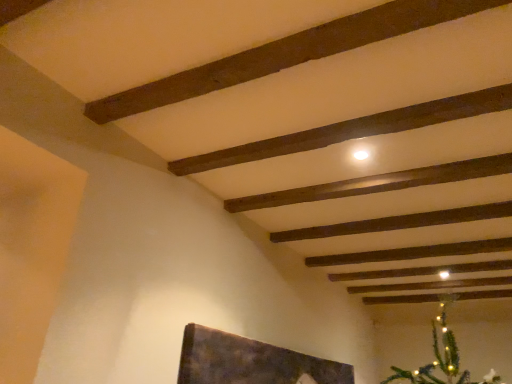
Locate an element on the screen. dark brown wood plank at upper center, which is the 2th plank in top-to-bottom order is located at coordinates (353, 130).

This screenshot has width=512, height=384. Find the location of `dark brown wood plank at upper center, which is the 2th plank in top-to-bottom order`. dark brown wood plank at upper center, which is the 2th plank in top-to-bottom order is located at coordinates (353, 130).

From the picture: Does dark brown wood plank at upper center, placed as the second plank when sorted from bottom to top, appear on the right side of smooth wooden plank at center, arranged as the first plank when ordered from the bottom?

In fact, dark brown wood plank at upper center, placed as the second plank when sorted from bottom to top, is to the left of smooth wooden plank at center, arranged as the first plank when ordered from the bottom.

From a real-world perspective, is dark brown wood plank at upper center, placed as the second plank when sorted from bottom to top, on smooth wooden plank at center, marked as the third plank in a top-to-bottom arrangement?

Indeed, from a real-world perspective, dark brown wood plank at upper center, placed as the second plank when sorted from bottom to top, stands above smooth wooden plank at center, marked as the third plank in a top-to-bottom arrangement.

Identify the location of the 1st plank directly above the smooth wooden plank at center, arranged as the first plank when ordered from the bottom (from a real-world perspective). (353, 130).

Which is behind, dark brown wood plank at upper center, placed as the second plank when sorted from bottom to top, or smooth wooden plank at center, arranged as the first plank when ordered from the bottom?

smooth wooden plank at center, arranged as the first plank when ordered from the bottom, is further from the camera.

Which is more to the left, smooth wooden plank at center, arranged as the first plank when ordered from the bottom, or dark brown wood plank at upper center, placed as the second plank when sorted from bottom to top?

dark brown wood plank at upper center, placed as the second plank when sorted from bottom to top, is more to the left.

Considering the sizes of smooth wooden plank at center, arranged as the first plank when ordered from the bottom, and dark brown wood plank at upper center, placed as the second plank when sorted from bottom to top, in the image, is smooth wooden plank at center, arranged as the first plank when ordered from the bottom, wider or thinner than dark brown wood plank at upper center, placed as the second plank when sorted from bottom to top,?

In the image, smooth wooden plank at center, arranged as the first plank when ordered from the bottom, appears to be more narrow than dark brown wood plank at upper center, placed as the second plank when sorted from bottom to top.

Between smooth wooden plank at center, arranged as the first plank when ordered from the bottom, and dark brown wood plank at upper center, which is the 2th plank in top-to-bottom order, which one has more height?

With more height is dark brown wood plank at upper center, which is the 2th plank in top-to-bottom order.

Does smooth wooden plank at center, marked as the third plank in a top-to-bottom arrangement, turn towards dark brown wood plank at upper center, placed as the third plank when sorted from bottom to top?

No, smooth wooden plank at center, marked as the third plank in a top-to-bottom arrangement, does not turn towards dark brown wood plank at upper center, placed as the third plank when sorted from bottom to top.

From a real-world perspective, between smooth wooden plank at center, marked as the third plank in a top-to-bottom arrangement, and dark brown wood plank at upper center, placed as the third plank when sorted from bottom to top, who is vertically lower?

In real-world perspective, smooth wooden plank at center, marked as the third plank in a top-to-bottom arrangement, is lower.

Image resolution: width=512 pixels, height=384 pixels. In order to click on the 2nd plank above the smooth wooden plank at center, arranged as the first plank when ordered from the bottom (from the image's perspective) in this screenshot , I will do (287, 54).

Can you confirm if dark brown wood plank at upper center, placed as the second plank when sorted from bottom to top, is wider than dark brown wood plank at upper center, placed as the third plank when sorted from bottom to top?

No, dark brown wood plank at upper center, placed as the second plank when sorted from bottom to top, is not wider than dark brown wood plank at upper center, placed as the third plank when sorted from bottom to top.

Which is behind, point (288, 143) or point (287, 45)?

The point (288, 143) is farther.

Between dark brown wood plank at upper center, which is the 2th plank in top-to-bottom order, and dark brown wood plank at upper center, placed as the third plank when sorted from bottom to top, which one has more height?

dark brown wood plank at upper center, placed as the third plank when sorted from bottom to top.

Considering the relative positions of dark brown wood plank at upper center, placed as the second plank when sorted from bottom to top, and dark brown wood plank at upper center, which ranks as the first plank in top-to-bottom order, in the image provided, is dark brown wood plank at upper center, placed as the second plank when sorted from bottom to top, behind dark brown wood plank at upper center, which ranks as the first plank in top-to-bottom order,?

Yes, dark brown wood plank at upper center, placed as the second plank when sorted from bottom to top, is behind dark brown wood plank at upper center, which ranks as the first plank in top-to-bottom order.

Is dark brown wood plank at upper center, which ranks as the first plank in top-to-bottom order, not close to smooth wooden plank at center, marked as the third plank in a top-to-bottom arrangement?

Actually, dark brown wood plank at upper center, which ranks as the first plank in top-to-bottom order, and smooth wooden plank at center, marked as the third plank in a top-to-bottom arrangement, are a little close together.

From the image's perspective, between dark brown wood plank at upper center, placed as the third plank when sorted from bottom to top, and smooth wooden plank at center, marked as the third plank in a top-to-bottom arrangement, which one is located above?

dark brown wood plank at upper center, placed as the third plank when sorted from bottom to top.

Considering the sizes of objects dark brown wood plank at upper center, which ranks as the first plank in top-to-bottom order, and smooth wooden plank at center, marked as the third plank in a top-to-bottom arrangement, in the image provided, who is thinner, dark brown wood plank at upper center, which ranks as the first plank in top-to-bottom order, or smooth wooden plank at center, marked as the third plank in a top-to-bottom arrangement,?

With smaller width is smooth wooden plank at center, marked as the third plank in a top-to-bottom arrangement.

Consider the image. Is dark brown wood plank at upper center, which ranks as the first plank in top-to-bottom order, positioned with its back to smooth wooden plank at center, arranged as the first plank when ordered from the bottom?

No, dark brown wood plank at upper center, which ranks as the first plank in top-to-bottom order,'s orientation is not away from smooth wooden plank at center, arranged as the first plank when ordered from the bottom.

Could you tell me if dark brown wood plank at upper center, which ranks as the first plank in top-to-bottom order, is facing dark brown wood plank at upper center, which is the 2th plank in top-to-bottom order?

Yes, dark brown wood plank at upper center, which ranks as the first plank in top-to-bottom order, is oriented towards dark brown wood plank at upper center, which is the 2th plank in top-to-bottom order.

Which of these two, dark brown wood plank at upper center, placed as the third plank when sorted from bottom to top, or dark brown wood plank at upper center, which is the 2th plank in top-to-bottom order, stands shorter?

dark brown wood plank at upper center, which is the 2th plank in top-to-bottom order, is shorter.

How distant is dark brown wood plank at upper center, which ranks as the first plank in top-to-bottom order, from dark brown wood plank at upper center, placed as the second plank when sorted from bottom to top?

17.43 inches.

From a real-world perspective, between dark brown wood plank at upper center, placed as the third plank when sorted from bottom to top, and dark brown wood plank at upper center, which is the 2th plank in top-to-bottom order, who is vertically lower?

From a 3D spatial view, dark brown wood plank at upper center, which is the 2th plank in top-to-bottom order, is below.

The width and height of the screenshot is (512, 384). Find the location of `plank on the right of the dark brown wood plank at upper center, which is the 2th plank in top-to-bottom order`. plank on the right of the dark brown wood plank at upper center, which is the 2th plank in top-to-bottom order is located at coordinates (378, 183).

From a real-world perspective, which plank is the 1st one above the smooth wooden plank at center, marked as the third plank in a top-to-bottom arrangement? Please provide its 2D coordinates.

[(353, 130)]

From the image, which object appears to be nearer to smooth wooden plank at center, arranged as the first plank when ordered from the bottom, dark brown wood plank at upper center, placed as the second plank when sorted from bottom to top, or dark brown wood plank at upper center, which ranks as the first plank in top-to-bottom order?

Based on the image, dark brown wood plank at upper center, placed as the second plank when sorted from bottom to top, appears to be nearer to smooth wooden plank at center, arranged as the first plank when ordered from the bottom.

Considering their positions, is smooth wooden plank at center, arranged as the first plank when ordered from the bottom, positioned closer to dark brown wood plank at upper center, which ranks as the first plank in top-to-bottom order, than dark brown wood plank at upper center, placed as the second plank when sorted from bottom to top?

Based on the image, dark brown wood plank at upper center, placed as the second plank when sorted from bottom to top, appears to be nearer to dark brown wood plank at upper center, which ranks as the first plank in top-to-bottom order.

Considering their positions, is smooth wooden plank at center, arranged as the first plank when ordered from the bottom, positioned further to dark brown wood plank at upper center, which is the 2th plank in top-to-bottom order, than dark brown wood plank at upper center, which ranks as the first plank in top-to-bottom order?

dark brown wood plank at upper center, which ranks as the first plank in top-to-bottom order, lies further to dark brown wood plank at upper center, which is the 2th plank in top-to-bottom order, than the other object.

Estimate the real-world distances between objects in this image. Which object is closer to dark brown wood plank at upper center, which ranks as the first plank in top-to-bottom order, dark brown wood plank at upper center, placed as the second plank when sorted from bottom to top, or smooth wooden plank at center, marked as the third plank in a top-to-bottom arrangement?

dark brown wood plank at upper center, placed as the second plank when sorted from bottom to top.

Looking at the image, which one is located further to smooth wooden plank at center, arranged as the first plank when ordered from the bottom, dark brown wood plank at upper center, which ranks as the first plank in top-to-bottom order, or dark brown wood plank at upper center, placed as the second plank when sorted from bottom to top?

dark brown wood plank at upper center, which ranks as the first plank in top-to-bottom order, is further to smooth wooden plank at center, arranged as the first plank when ordered from the bottom.

Considering their positions, is dark brown wood plank at upper center, placed as the third plank when sorted from bottom to top, positioned closer to dark brown wood plank at upper center, which is the 2th plank in top-to-bottom order, than smooth wooden plank at center, arranged as the first plank when ordered from the bottom?

smooth wooden plank at center, arranged as the first plank when ordered from the bottom, is closer to dark brown wood plank at upper center, which is the 2th plank in top-to-bottom order.

Locate an element on the screen. The height and width of the screenshot is (384, 512). plank between dark brown wood plank at upper center, which ranks as the first plank in top-to-bottom order, and smooth wooden plank at center, arranged as the first plank when ordered from the bottom, along the z-axis is located at coordinates (353, 130).